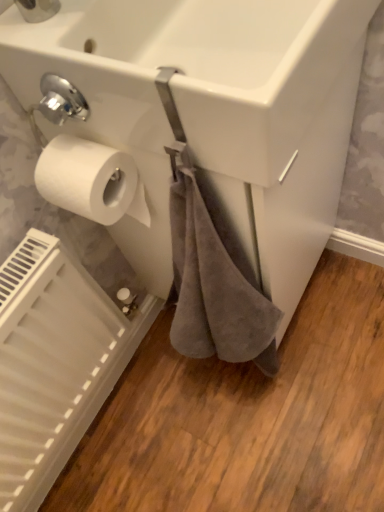
Question: Is white matte toilet paper at left further to the viewer compared to white matte radiator at lower left?

Choices:
 (A) yes
 (B) no

Answer: (B)

Question: Is white matte radiator at lower left inside white matte toilet paper at left?

Choices:
 (A) no
 (B) yes

Answer: (A)

Question: Is white matte toilet paper at left wider than white matte radiator at lower left?

Choices:
 (A) no
 (B) yes

Answer: (B)

Question: Considering the relative sizes of white matte toilet paper at left and white matte radiator at lower left in the image provided, is white matte toilet paper at left shorter than white matte radiator at lower left?

Choices:
 (A) yes
 (B) no

Answer: (A)

Question: Is white matte toilet paper at left at the right side of white matte radiator at lower left?

Choices:
 (A) yes
 (B) no

Answer: (A)

Question: Is white glossy sink at upper center bigger or smaller than white matte radiator at lower left?

Choices:
 (A) big
 (B) small

Answer: (A)

Question: Considering the positions of point (107, 101) and point (69, 397), is point (107, 101) closer or farther from the camera than point (69, 397)?

Choices:
 (A) farther
 (B) closer

Answer: (B)

Question: From the image's perspective, is white glossy sink at upper center above or below white matte radiator at lower left?

Choices:
 (A) above
 (B) below

Answer: (A)

Question: In terms of height, does white glossy sink at upper center look taller or shorter compared to white matte radiator at lower left?

Choices:
 (A) tall
 (B) short

Answer: (B)

Question: From a real-world perspective, is white glossy sink at upper center above or below white matte toilet paper at left?

Choices:
 (A) above
 (B) below

Answer: (A)

Question: From the image's perspective, is white glossy sink at upper center above or below white matte toilet paper at left?

Choices:
 (A) below
 (B) above

Answer: (B)

Question: Does point (289, 117) appear closer or farther from the camera than point (114, 168)?

Choices:
 (A) closer
 (B) farther

Answer: (A)

Question: Considering their positions, is white glossy sink at upper center located in front of or behind white matte toilet paper at left?

Choices:
 (A) front
 (B) behind

Answer: (A)

Question: Choose the correct answer: Is white matte toilet paper at left inside white glossy sink at upper center or outside it?

Choices:
 (A) inside
 (B) outside

Answer: (B)

Question: Looking at their shapes, would you say white matte toilet paper at left is wider or thinner than white glossy sink at upper center?

Choices:
 (A) wide
 (B) thin

Answer: (B)